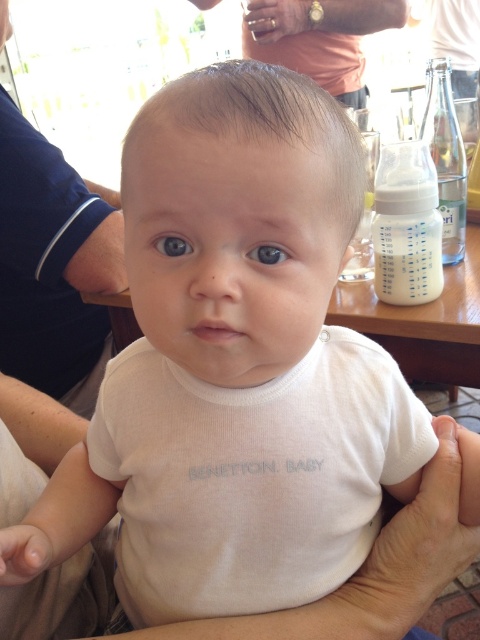
You are a caregiver who needs to prepare a bottle for the baby in the image. You see the white plastic baby bottle at upper right and the brown glossy eye at center. Which object is taller and can be used to measure the milk level?

The white plastic baby bottle at upper right is taller than the brown glossy eye at center, so it can be used to measure the milk level.